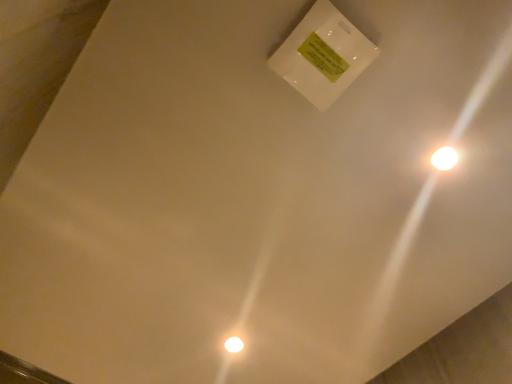
The image size is (512, 384). I want to click on vacant space behind white glossy light bulb at lower center, so click(232, 366).